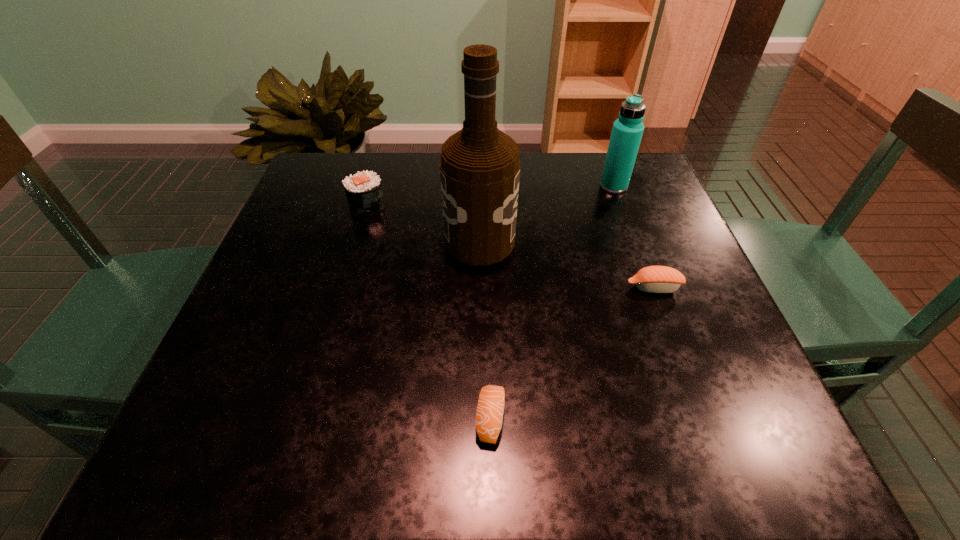
Locate an element on the screen. Image resolution: width=960 pixels, height=540 pixels. vacant region located on the label of the tallest object is located at coordinates (606, 241).

Where is `blank area located on the front of the fourth shortest object`? blank area located on the front of the fourth shortest object is located at coordinates (649, 282).

Locate an element on the screen. vacant space located on the back of the fourth nearest object is located at coordinates (378, 167).

Locate an element on the screen. free spot located 0.250m on the left of the second farthest sushi is located at coordinates (499, 288).

Find the location of a particular element. vacant space positioned 0.400m on the right of the shortest object is located at coordinates (763, 418).

Where is `water bottle situated at the far edge`? water bottle situated at the far edge is located at coordinates (627, 131).

The image size is (960, 540). Identify the location of sushi at the far edge. (363, 190).

The height and width of the screenshot is (540, 960). What are the coordinates of `object that is at the near edge` in the screenshot? It's located at pyautogui.click(x=489, y=416).

Locate an element on the screen. This screenshot has width=960, height=540. object present at the left edge is located at coordinates (363, 190).

Where is `water bottle that is at the right edge`? The image size is (960, 540). water bottle that is at the right edge is located at coordinates (627, 131).